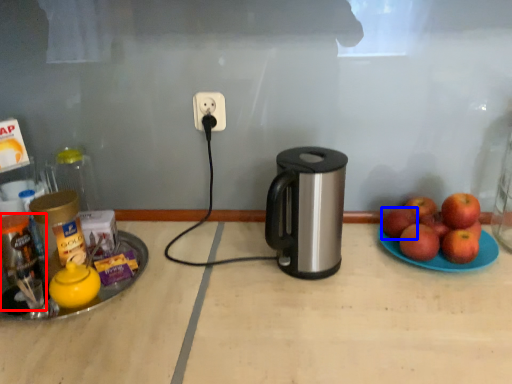
Question: Which point is closer to the camera, bottle (highlighted by a red box) or apple (highlighted by a blue box)?

Choices:
 (A) bottle
 (B) apple

Answer: (A)